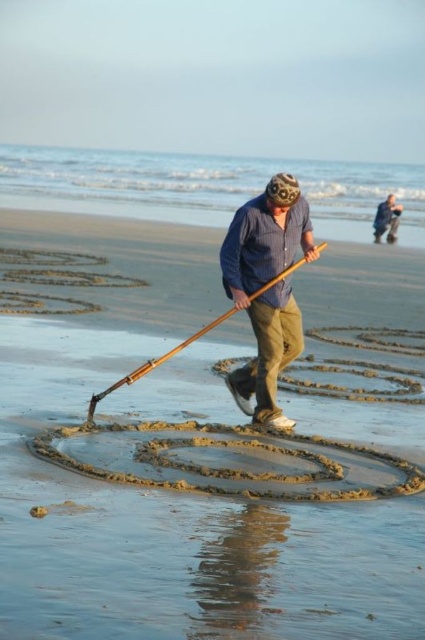
Between blue striped shirt at center and blue striped shirt at upper center, which one has less height?

Standing shorter between the two is blue striped shirt at upper center.

Does blue striped shirt at center have a greater width compared to blue striped shirt at upper center?

No, blue striped shirt at center is not wider than blue striped shirt at upper center.

Between point (277, 292) and point (376, 221), which one is positioned in front?

Point (277, 292)

Locate an element on the screen. Image resolution: width=425 pixels, height=640 pixels. blue striped shirt at center is located at coordinates (266, 289).

Does sandy beach at center have a lesser height compared to blue striped shirt at upper center?

Incorrect, sandy beach at center's height does not fall short of blue striped shirt at upper center's.

Consider the image. Between sandy beach at center and blue striped shirt at upper center, which one appears on the right side from the viewer's perspective?

Positioned to the right is blue striped shirt at upper center.

Is point (99, 410) closer to viewer compared to point (396, 237)?

That is True.

In order to click on sandy beach at center in this screenshot , I will do `click(169, 493)`.

Does sandy beach at center come in front of blue striped shirt at center?

Yes.

Is point (257, 612) farther from camera compared to point (289, 317)?

No, it is not.

Does point (170, 545) lie in front of point (263, 228)?

Yes, point (170, 545) is in front of point (263, 228).

Locate an element on the screen. The height and width of the screenshot is (640, 425). sandy beach at center is located at coordinates (169, 493).